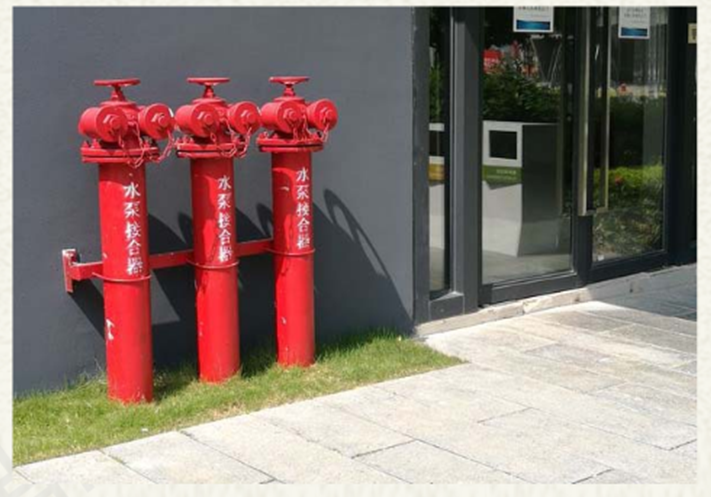
You are a GUI agent. You are given a task and a screenshot of the screen. Output one action in this format:
    pyautogui.click(x=<x>, y=<y>)
    Task: Click on the turn knobs
    This screenshot has height=497, width=711.
    Given the screenshot: What is the action you would take?
    pyautogui.click(x=114, y=84), pyautogui.click(x=215, y=77), pyautogui.click(x=292, y=78)